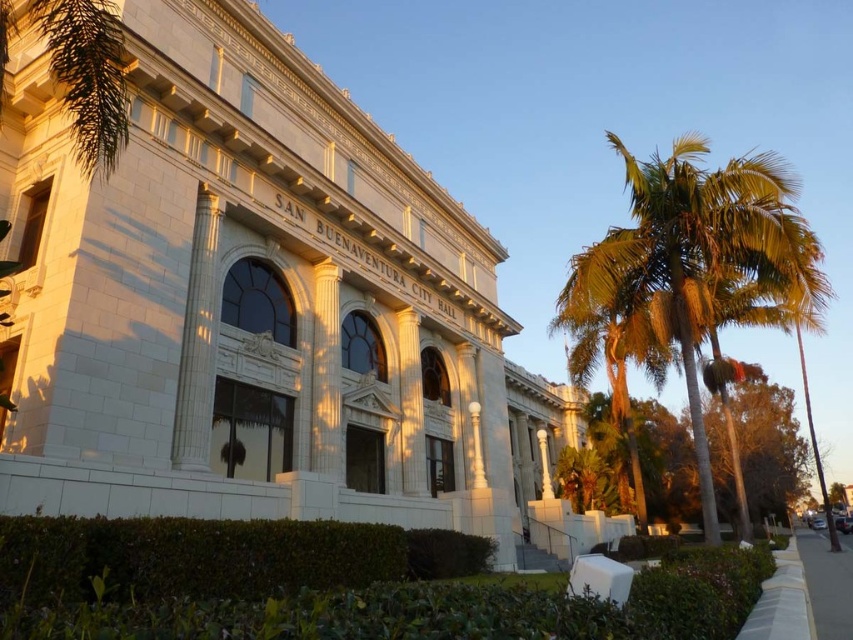
Consider the image. Between green leafy palm tree at right and gray concrete sidewalk at lower right, which one has less height?

Standing shorter between the two is green leafy palm tree at right.

Between point (660, 173) and point (834, 582), which one is positioned behind?

The point (660, 173) is more distant.

The width and height of the screenshot is (853, 640). I want to click on green leafy palm tree at right, so click(699, 260).